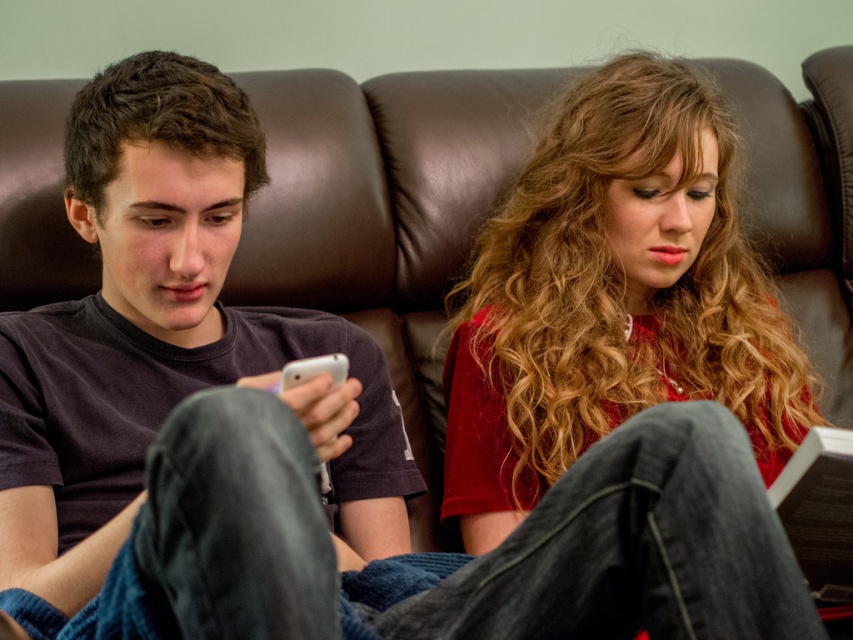
Is matte black phone at left in front of matte red shirt at center?

Yes, matte black phone at left is closer to the viewer.

Based on the photo, who is shorter, matte black phone at left or matte red shirt at center?

matte black phone at left is shorter.

Is point (28, 388) behind point (599, 227)?

No, (28, 388) is in front of (599, 227).

The height and width of the screenshot is (640, 853). I want to click on matte black phone at left, so click(167, 337).

Can you confirm if matte black phone at left is shorter than white glossy smartphone at center?

No, matte black phone at left is not shorter than white glossy smartphone at center.

Which of these two, matte black phone at left or white glossy smartphone at center, stands shorter?

With less height is white glossy smartphone at center.

Does point (56, 592) come behind point (339, 362)?

No, it is in front of (339, 362).

Where is `matte black phone at left`? The height and width of the screenshot is (640, 853). matte black phone at left is located at coordinates (167, 337).

Does matte red shirt at center appear on the left side of white glossy smartphone at center?

In fact, matte red shirt at center is to the right of white glossy smartphone at center.

Is point (527, 346) closer to viewer compared to point (285, 368)?

No, it is behind (285, 368).

I want to click on matte red shirt at center, so click(x=612, y=298).